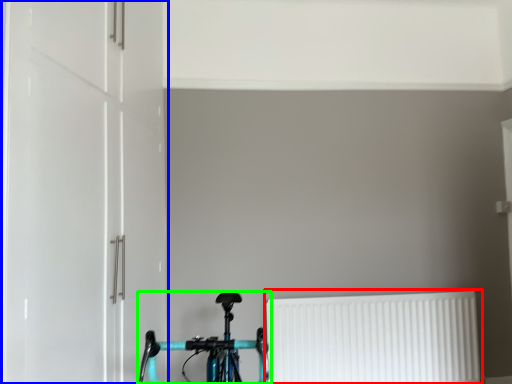
Question: Which object is positioned closest to radiator (highlighted by a red box)? Select from door (highlighted by a blue box) and bicycle (highlighted by a green box).

Choices:
 (A) door
 (B) bicycle

Answer: (B)